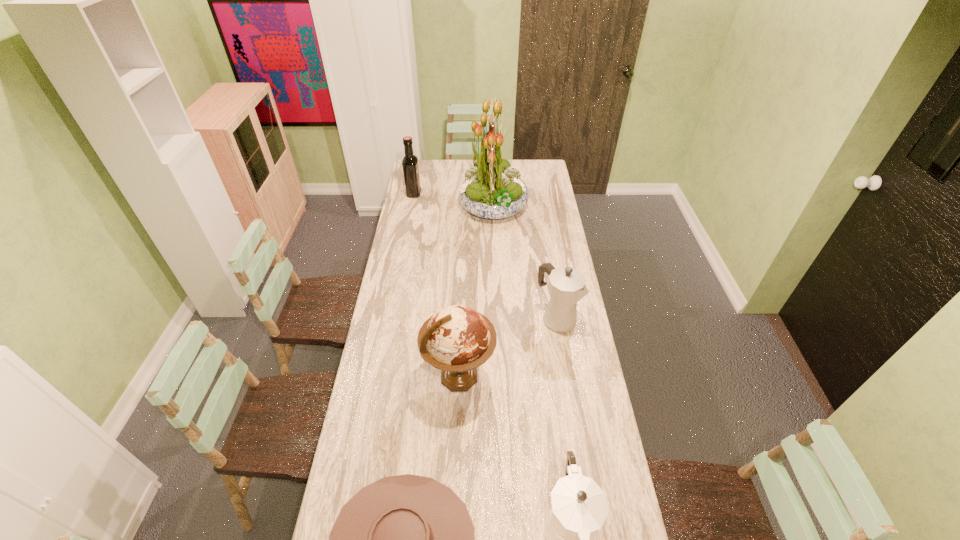
The width and height of the screenshot is (960, 540). In order to click on free space between the farther coffeepot and the liquor in this screenshot , I will do `click(485, 256)`.

I want to click on empty space that is in between the globe and the liquor, so click(437, 285).

Locate an element on the screen. object that can be found as the fifth closest to the flower arrangement is located at coordinates (579, 508).

Identify which object is the third nearest to the nearer coffeepot. Please provide its 2D coordinates. Your answer should be formatted as a tuple, i.e. [(x, y)], where the tuple contains the x and y coordinates of a point satisfying the conditions above.

[(567, 286)]

The height and width of the screenshot is (540, 960). I want to click on free spot that satisfies the following two spatial constraints: 1. on the front-facing side of the farther coffeepot; 2. on the left side of the flower arrangement, so click(498, 318).